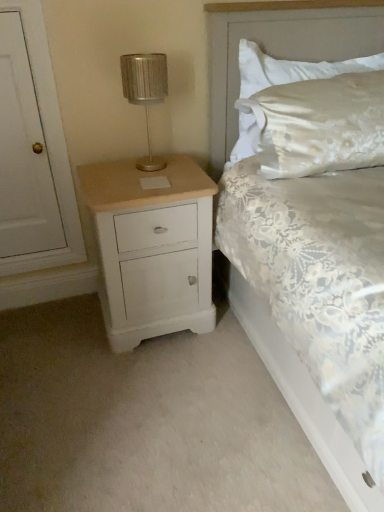
Question: From the image's perspective, is white lace bed at center located above or below metallic silver table lamp at upper left?

Choices:
 (A) above
 (B) below

Answer: (B)

Question: Is white lace bed at center in front of or behind metallic silver table lamp at upper left in the image?

Choices:
 (A) front
 (B) behind

Answer: (A)

Question: Estimate the real-world distances between objects in this image. Which object is farther from the satin white pillow at upper right?

Choices:
 (A) white lace bed at center
 (B) white painted wood door at left
 (C) metallic silver table lamp at upper left
 (D) white painted wood chest of drawers at left

Answer: (B)

Question: Which of these objects is positioned farthest from the satin white pillow at upper right?

Choices:
 (A) metallic silver table lamp at upper left
 (B) white lace bed at center
 (C) white painted wood door at left
 (D) white painted wood chest of drawers at left

Answer: (C)